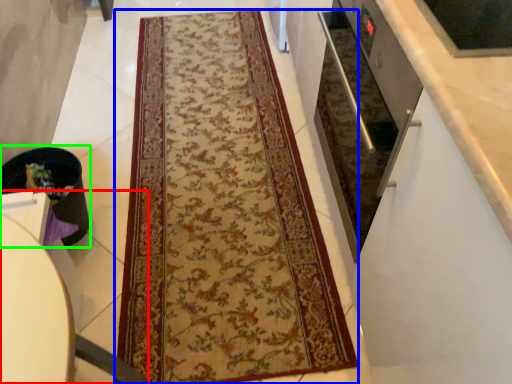
Question: Estimate the real-world distances between objects in this image. Which object is closer to furniture (highlighted by a red box), mat (highlighted by a blue box) or appliance (highlighted by a green box)?

Choices:
 (A) mat
 (B) appliance

Answer: (B)